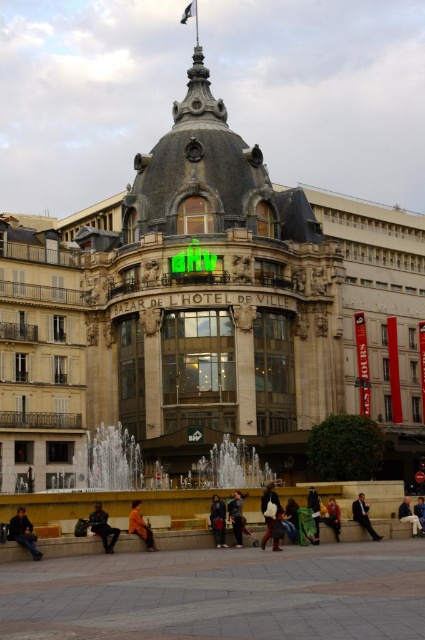
Between matte black bag at center and dark brown leather jacket at lower left, which one has less height?

dark brown leather jacket at lower left

Is matte black bag at center taller than dark brown leather jacket at lower left?

Yes, matte black bag at center is taller than dark brown leather jacket at lower left.

Identify the location of matte black bag at center. The width and height of the screenshot is (425, 640). (271, 516).

Between red leather jacket at center and blue denim jeans at lower center, which one appears on the right side from the viewer's perspective?

blue denim jeans at lower center is more to the right.

Is red leather jacket at center positioned in front of blue denim jeans at lower center?

That is True.

At what (x,y) coordinates should I click in order to perform the action: click on red leather jacket at center. Please return your answer as a coordinate pair (x, y). The image size is (425, 640). Looking at the image, I should click on 333,516.

Where is `red leather jacket at center`? The width and height of the screenshot is (425, 640). red leather jacket at center is located at coordinates (333, 516).

Measure the distance between light blue jeans at lower right and green fabric jacket at lower center.

A distance of 4.88 meters exists between light blue jeans at lower right and green fabric jacket at lower center.

Identify the location of light blue jeans at lower right. (408, 516).

The height and width of the screenshot is (640, 425). I want to click on light blue jeans at lower right, so click(408, 516).